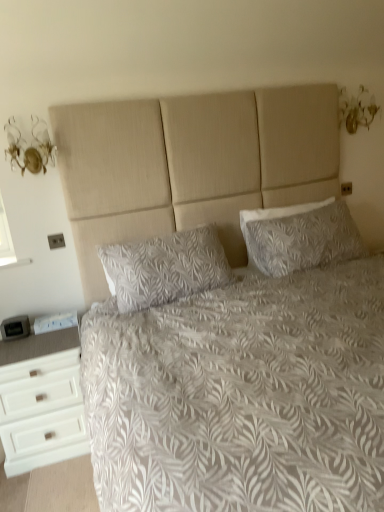
Question: Is white leaf-patterned pillow at center, the second pillow in the right-to-left sequence, outside white textured bed at center?

Choices:
 (A) no
 (B) yes

Answer: (A)

Question: From the image's perspective, is white leaf-patterned pillow at center, the second pillow in the right-to-left sequence, under white textured bed at center?

Choices:
 (A) no
 (B) yes

Answer: (A)

Question: Does white leaf-patterned pillow at center, the second pillow in the right-to-left sequence, appear on the left side of white textured bed at center?

Choices:
 (A) yes
 (B) no

Answer: (A)

Question: Can you confirm if white leaf-patterned pillow at center, the second pillow in the right-to-left sequence, is bigger than white textured bed at center?

Choices:
 (A) yes
 (B) no

Answer: (B)

Question: Would you say white textured bed at center is part of white leaf-patterned pillow at center, placed as the first pillow when sorted from left to right,'s contents?

Choices:
 (A) yes
 (B) no

Answer: (B)

Question: Can you confirm if white leaf-patterned pillow at center, placed as the first pillow when sorted from left to right, is taller than white textured bed at center?

Choices:
 (A) yes
 (B) no

Answer: (B)

Question: Is white textured bed at center at the left side of white textured pillow at upper right, placed as the first pillow when sorted from right to left?

Choices:
 (A) no
 (B) yes

Answer: (B)

Question: Considering the relative positions of white textured bed at center and white textured pillow at upper right, acting as the second pillow starting from the left, in the image provided, is white textured bed at center behind white textured pillow at upper right, acting as the second pillow starting from the left,?

Choices:
 (A) no
 (B) yes

Answer: (A)

Question: From the image's perspective, is white textured bed at center below white textured pillow at upper right, placed as the first pillow when sorted from right to left?

Choices:
 (A) yes
 (B) no

Answer: (A)

Question: Is white textured bed at center wider than white textured pillow at upper right, acting as the second pillow starting from the left?

Choices:
 (A) yes
 (B) no

Answer: (A)

Question: Considering the relative sizes of white textured bed at center and white textured pillow at upper right, acting as the second pillow starting from the left, in the image provided, is white textured bed at center bigger than white textured pillow at upper right, acting as the second pillow starting from the left,?

Choices:
 (A) yes
 (B) no

Answer: (A)

Question: Can you confirm if white textured bed at center is thinner than white textured pillow at upper right, placed as the first pillow when sorted from right to left?

Choices:
 (A) yes
 (B) no

Answer: (B)

Question: Does white textured bed at center have a greater height compared to white leaf-patterned pillow at center, the second pillow in the right-to-left sequence?

Choices:
 (A) no
 (B) yes

Answer: (B)